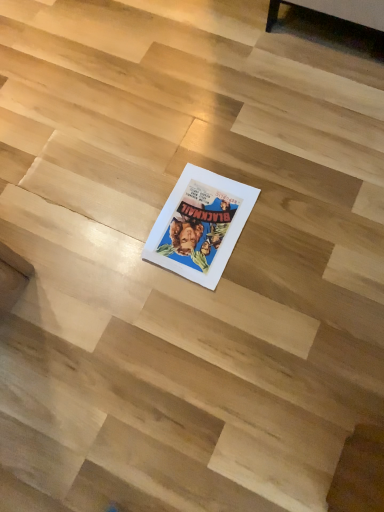
You are a GUI agent. You are given a task and a screenshot of the screen. Output one action in this format:
    pyautogui.click(x=<x>, y=<y>)
    Task: Click on the vacant area in front of white paper book at center
    Image resolution: width=384 pixels, height=512 pixels.
    Given the screenshot: What is the action you would take?
    pyautogui.click(x=215, y=316)